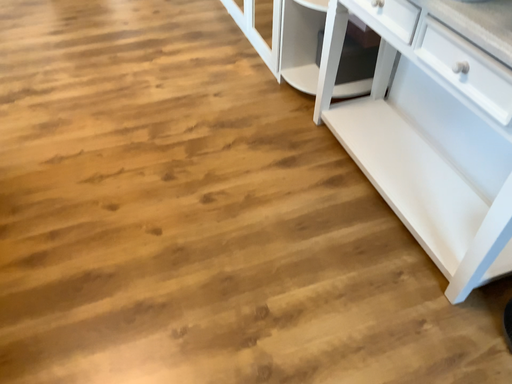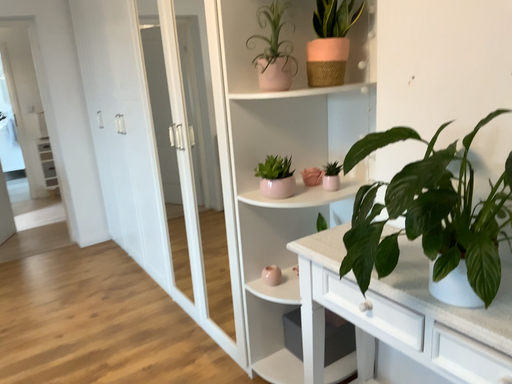
Question: How did the camera likely rotate when shooting the video?

Choices:
 (A) rotated downward
 (B) rotated upward

Answer: (B)